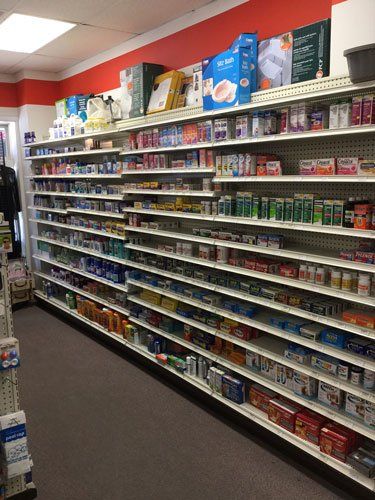
You are a GUI agent. You are given a task and a screenshot of the screen. Output one action in this format:
    pyautogui.click(x=<x>, y=<y>)
    Task: Click on the recessed ceiling light
    This screenshot has width=375, height=500.
    Given the screenshot: What is the action you would take?
    pyautogui.click(x=27, y=31)